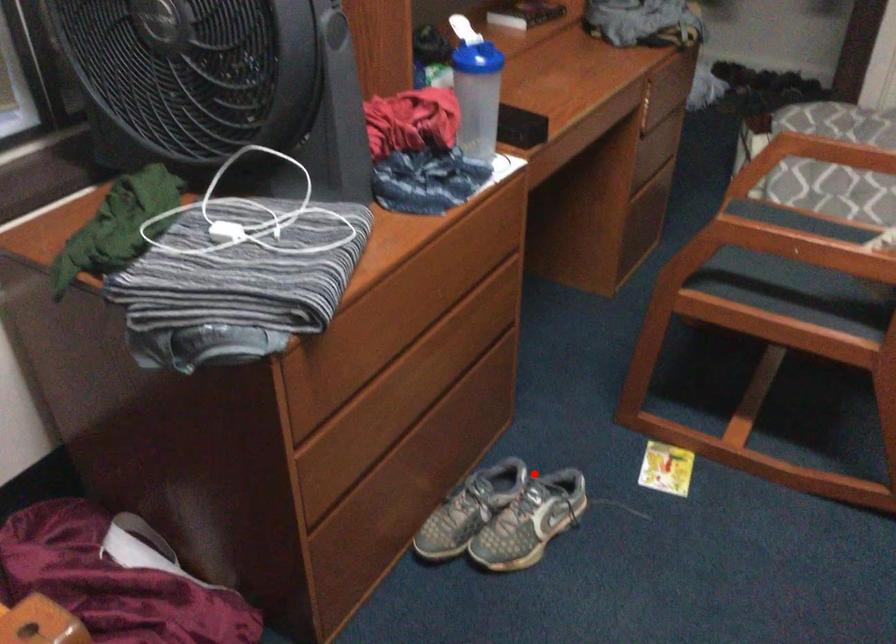
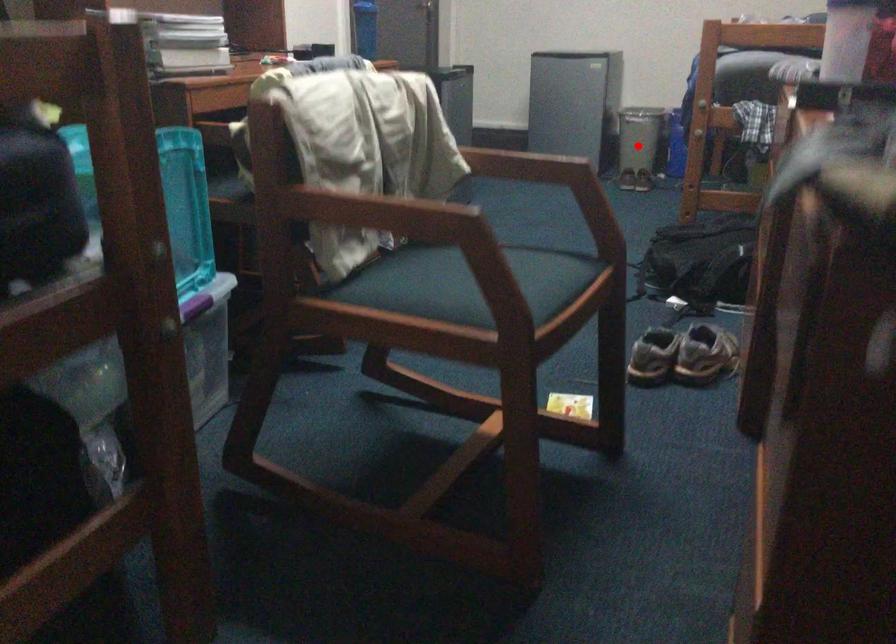
I am providing you with two images of the same scene from different viewpoints. A red point is marked on the first image and another point is marked on the second image. Are the points marked in image1 and image2 representing the same 3D position?

No